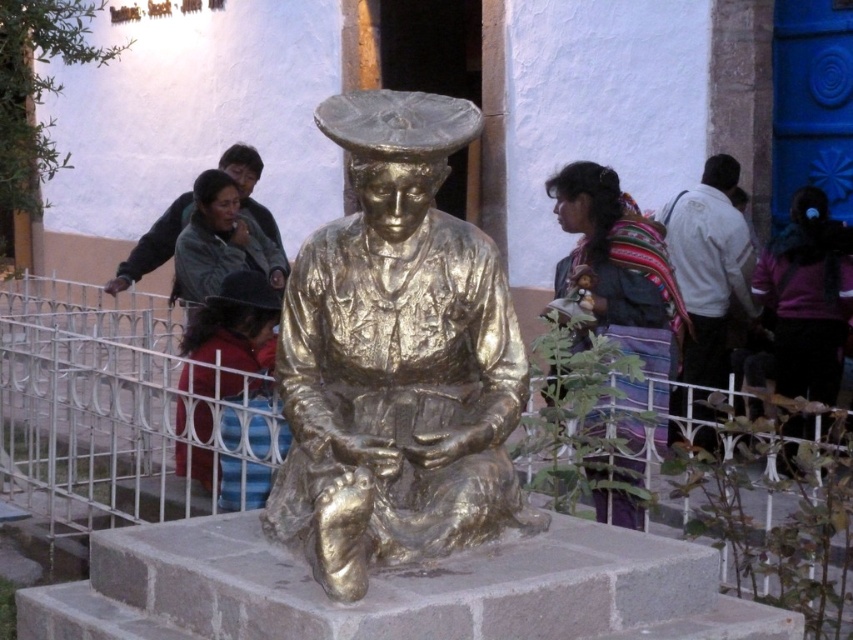
Who is positioned more to the right, multicolored woven fabric at right or red fabric pants at lower left?

Positioned to the right is multicolored woven fabric at right.

Is multicolored woven fabric at right above red fabric pants at lower left?

Yes, multicolored woven fabric at right is above red fabric pants at lower left.

Image resolution: width=853 pixels, height=640 pixels. I want to click on multicolored woven fabric at right, so click(618, 262).

I want to click on multicolored woven fabric at right, so click(x=618, y=262).

Is gold-bronze statue at center wider than multicolored woven fabric at right?

Indeed, gold-bronze statue at center has a greater width compared to multicolored woven fabric at right.

Between point (399, 563) and point (657, 275), which one is positioned in front?

Point (399, 563)

The image size is (853, 640). I want to click on gold-bronze statue at center, so click(396, 358).

From the picture: Can you confirm if gold-bronze statue at center is positioned below white cotton shirt at right?

Yes, gold-bronze statue at center is below white cotton shirt at right.

Can you confirm if gold-bronze statue at center is thinner than white cotton shirt at right?

No, gold-bronze statue at center is not thinner than white cotton shirt at right.

Describe the element at coordinates (396, 358) in the screenshot. I see `gold-bronze statue at center` at that location.

Image resolution: width=853 pixels, height=640 pixels. I want to click on gold-bronze statue at center, so click(x=396, y=358).